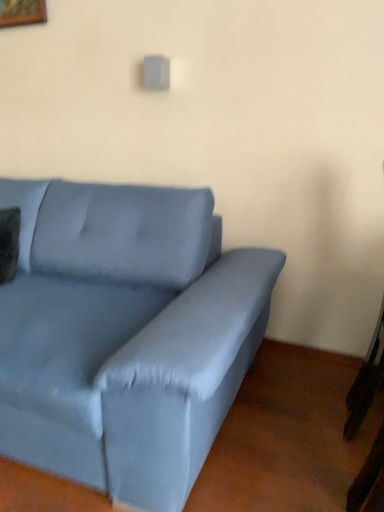
Measure the distance between point (137, 411) and camera.

Point (137, 411) and camera are 3.67 feet apart.

This screenshot has width=384, height=512. I want to click on satin blue couch at center, so click(125, 335).

The width and height of the screenshot is (384, 512). What do you see at coordinates (125, 335) in the screenshot?
I see `satin blue couch at center` at bounding box center [125, 335].

This screenshot has width=384, height=512. What are the coordinates of `satin blue couch at center` in the screenshot? It's located at (125, 335).